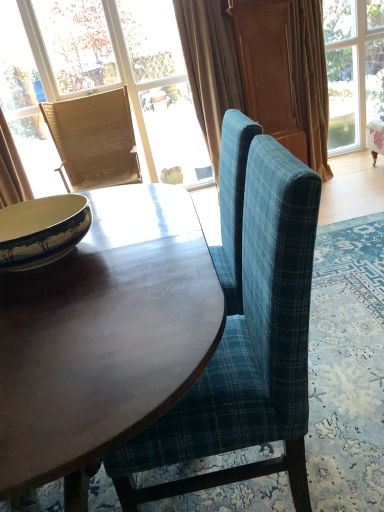
Question: Is matte wicker chair at upper left, arranged as the 2th window when viewed from the right, not close to beige velvet curtain at upper center, which is the 2th curtain in right-to-left order?

Choices:
 (A) yes
 (B) no

Answer: (B)

Question: Can you confirm if matte wicker chair at upper left, arranged as the 2th window when viewed from the right, is bigger than beige velvet curtain at upper center, the second curtain from the left?

Choices:
 (A) yes
 (B) no

Answer: (A)

Question: Can you confirm if matte wicker chair at upper left, positioned as the first window in left-to-right order, is thinner than beige velvet curtain at upper center, the second curtain from the left?

Choices:
 (A) no
 (B) yes

Answer: (B)

Question: Is matte wicker chair at upper left, arranged as the 2th window when viewed from the right, positioned beyond the bounds of beige velvet curtain at upper center, the second curtain from the left?

Choices:
 (A) no
 (B) yes

Answer: (B)

Question: Are matte wicker chair at upper left, arranged as the 2th window when viewed from the right, and beige velvet curtain at upper center, which is the 2th curtain in right-to-left order, making contact?

Choices:
 (A) no
 (B) yes

Answer: (A)

Question: Does point (16, 154) appear closer or farther from the camera than point (200, 151)?

Choices:
 (A) farther
 (B) closer

Answer: (B)

Question: Considering the positions of beige fabric curtain at left, which is the first curtain from left to right, and matte wicker chair at upper left, positioned as the first window in left-to-right order, in the image, is beige fabric curtain at left, which is the first curtain from left to right, wider or thinner than matte wicker chair at upper left, positioned as the first window in left-to-right order,?

Choices:
 (A) thin
 (B) wide

Answer: (B)

Question: Visually, is beige fabric curtain at left, which is the first curtain from left to right, positioned to the left or to the right of matte wicker chair at upper left, positioned as the first window in left-to-right order?

Choices:
 (A) right
 (B) left

Answer: (B)

Question: From a real-world perspective, is beige fabric curtain at left, which is the first curtain from left to right, physically located above or below matte wicker chair at upper left, arranged as the 2th window when viewed from the right?

Choices:
 (A) above
 (B) below

Answer: (B)

Question: Looking at the image, does blue plaid fabric chair at center, the 1th chair when ordered from front to back, seem bigger or smaller compared to wooden screen door at upper center?

Choices:
 (A) small
 (B) big

Answer: (B)

Question: From a real-world perspective, is blue plaid fabric chair at center, placed as the second chair when sorted from back to front, above or below wooden screen door at upper center?

Choices:
 (A) above
 (B) below

Answer: (B)

Question: From their relative heights in the image, would you say blue plaid fabric chair at center, which is the second chair from top to bottom, is taller or shorter than wooden screen door at upper center?

Choices:
 (A) short
 (B) tall

Answer: (A)

Question: Would you say blue plaid fabric chair at center, which is the second chair from top to bottom, is to the left or to the right of wooden screen door at upper center in the picture?

Choices:
 (A) left
 (B) right

Answer: (A)

Question: Considering their positions, is yellow glazed bowl at left located in front of or behind silky beige curtain at upper right, positioned as the 1th curtain in right-to-left order?

Choices:
 (A) front
 (B) behind

Answer: (A)

Question: Is yellow glazed bowl at left taller or shorter than silky beige curtain at upper right, positioned as the 1th curtain in right-to-left order?

Choices:
 (A) short
 (B) tall

Answer: (A)